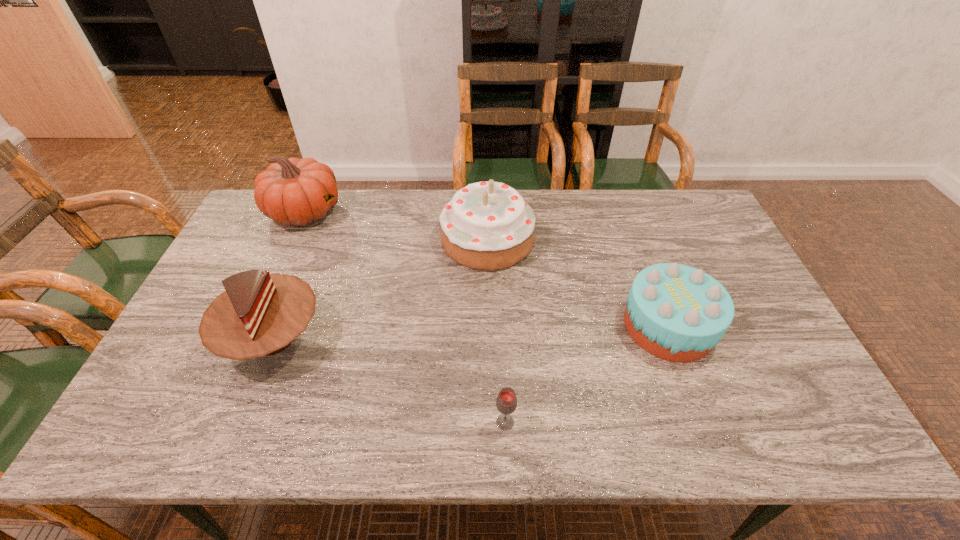
Find the location of a particular element. This screenshot has height=540, width=960. vacant space located on the left of the nearest object is located at coordinates (424, 422).

This screenshot has height=540, width=960. I want to click on pumpkin present at the far edge, so click(x=293, y=191).

Image resolution: width=960 pixels, height=540 pixels. I want to click on cake present at the far edge, so click(487, 225).

Find the location of `object that is at the near edge`. object that is at the near edge is located at coordinates (506, 402).

The image size is (960, 540). Identify the location of pumpkin that is positioned at the left edge. [x=293, y=191].

In order to click on cake situated at the left edge in this screenshot , I will do `click(260, 314)`.

You are a GUI agent. You are given a task and a screenshot of the screen. Output one action in this format:
    pyautogui.click(x=<x>, y=<y>)
    Task: Click on the object that is at the right edge
    Image resolution: width=960 pixels, height=540 pixels.
    Given the screenshot: What is the action you would take?
    pyautogui.click(x=675, y=312)

Identify the location of object that is positioned at the far left corner. (293, 191).

Image resolution: width=960 pixels, height=540 pixels. In the image, there is a desktop. Identify the location of vacant space at the far edge. (413, 217).

What are the coordinates of `free space at the near edge of the desktop` in the screenshot? It's located at (333, 415).